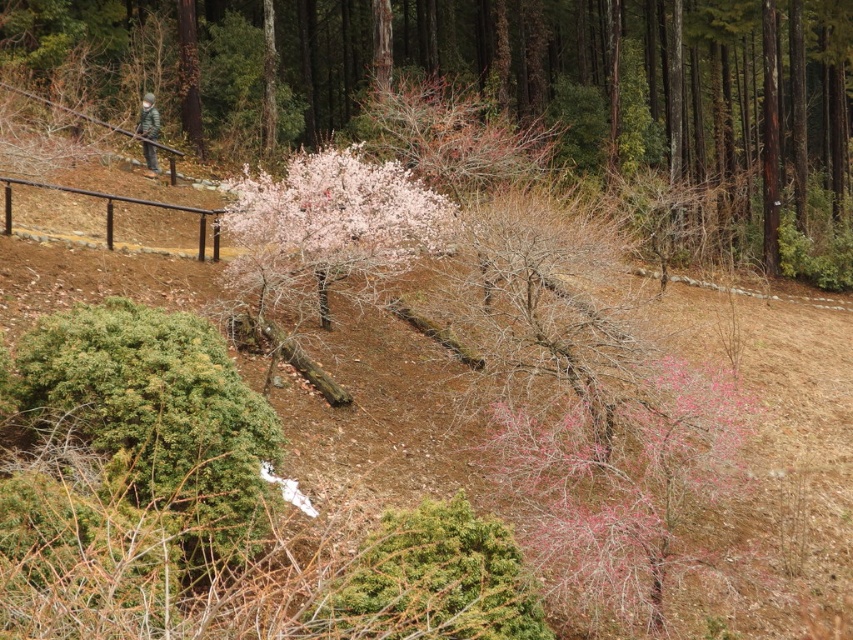
Question: Does pink textured bush at center appear on the left side of camouflage fabric person at upper left?

Choices:
 (A) no
 (B) yes

Answer: (A)

Question: Which is farther from the camouflage fabric person at upper left?

Choices:
 (A) pink matte tree at center
 (B) pink textured bush at center

Answer: (B)

Question: Is pink textured bush at center below camouflage fabric person at upper left?

Choices:
 (A) no
 (B) yes

Answer: (A)

Question: Which object appears closest to the camera in this image?

Choices:
 (A) pink matte tree at center
 (B) camouflage fabric person at upper left

Answer: (A)

Question: Considering the real-world distances, which object is closest to the pink textured bush at center?

Choices:
 (A) pink matte tree at center
 (B) camouflage fabric person at upper left

Answer: (A)

Question: Does pink textured bush at center have a greater width compared to pink matte tree at center?

Choices:
 (A) yes
 (B) no

Answer: (A)